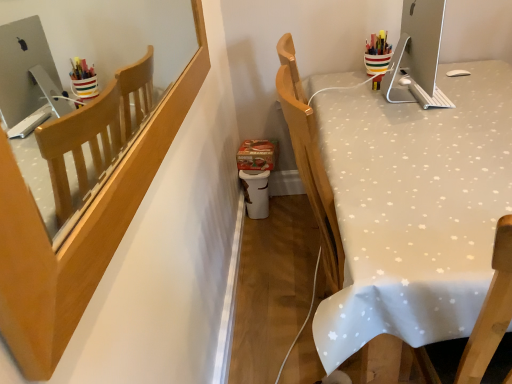
The image size is (512, 384). Describe the element at coordinates (415, 209) in the screenshot. I see `white fabric-covered desk at right` at that location.

What do you see at coordinates (418, 54) in the screenshot?
I see `satin silver monitor at upper right` at bounding box center [418, 54].

Find the location of a particular element. wooden chair back at upper left is located at coordinates (92, 99).

This screenshot has height=384, width=512. Identify the location of white fabric-covered desk at right. [x=415, y=209].

Consider the image. Is satin silver monitor at upper right surrounded by wooden chair back at upper left?

No, satin silver monitor at upper right is located outside of wooden chair back at upper left.

Locate an element on the screen. desktop behind the wooden chair back at upper left is located at coordinates (418, 54).

Based on the photo, from the image's perspective, between wooden chair back at upper left and satin silver monitor at upper right, who is located below?

wooden chair back at upper left is shown below in the image.

Considering the sizes of objects wooden chair back at upper left and satin silver monitor at upper right in the image provided, who is thinner, wooden chair back at upper left or satin silver monitor at upper right?

Thinner between the two is wooden chair back at upper left.

From the image's perspective, is satin silver monitor at upper right below wooden chair back at upper left?

Actually, satin silver monitor at upper right appears above wooden chair back at upper left in the image.

Is satin silver monitor at upper right inside or outside of wooden chair back at upper left?

The correct answer is: outside.

Between satin silver monitor at upper right and wooden chair back at upper left, which one has smaller size?

wooden chair back at upper left.

Considering the points (445, 102) and (195, 22), which point is in front, point (445, 102) or point (195, 22)?

The point (445, 102) is more forward.

Considering the relative sizes of white fabric-covered desk at right and wooden chair back at upper left in the image provided, is white fabric-covered desk at right bigger than wooden chair back at upper left?

Yes.

Can you confirm if white fabric-covered desk at right is wider than wooden chair back at upper left?

Indeed, white fabric-covered desk at right has a greater width compared to wooden chair back at upper left.

Does white fabric-covered desk at right appear on the left side of wooden chair back at upper left?

No.

Is white fabric-covered desk at right located outside wooden chair back at upper left?

Yes.

Can you tell me how much wooden chair back at upper left and white fabric-covered desk at right differ in facing direction?

wooden chair back at upper left and white fabric-covered desk at right are facing 90 degrees away from each other.

From the image's perspective, is wooden chair back at upper left on top of white fabric-covered desk at right?

Yes, from the image's perspective, wooden chair back at upper left is above white fabric-covered desk at right.

Locate an element on the screen. desk located underneath the wooden chair back at upper left (from a real-world perspective) is located at coordinates (415, 209).

Considering the sizes of objects wooden chair back at upper left and white fabric-covered desk at right in the image provided, who is bigger, wooden chair back at upper left or white fabric-covered desk at right?

With larger size is white fabric-covered desk at right.

How many degrees apart are the facing directions of satin silver monitor at upper right and white fabric-covered desk at right?

They differ by 90 degrees in their facing directions.

Does satin silver monitor at upper right come behind white fabric-covered desk at right?

Yes, it is.

Is satin silver monitor at upper right oriented away from white fabric-covered desk at right?

No, satin silver monitor at upper right's orientation is not away from white fabric-covered desk at right.

From the image's perspective, is satin silver monitor at upper right under white fabric-covered desk at right?

Actually, satin silver monitor at upper right appears above white fabric-covered desk at right in the image.

Based on their sizes in the image, would you say white fabric-covered desk at right is bigger or smaller than satin silver monitor at upper right?

In the image, white fabric-covered desk at right appears to be larger than satin silver monitor at upper right.

Considering the relative positions of white fabric-covered desk at right and satin silver monitor at upper right in the image provided, is white fabric-covered desk at right to the right of satin silver monitor at upper right from the viewer's perspective?

Indeed, white fabric-covered desk at right is positioned on the right side of satin silver monitor at upper right.

How different are the orientations of white fabric-covered desk at right and satin silver monitor at upper right in degrees?

They differ by 90 degrees in their facing directions.

Where is `desktop on the right side of wooden chair back at upper left`? The height and width of the screenshot is (384, 512). desktop on the right side of wooden chair back at upper left is located at coordinates (418, 54).

Locate an element on the screen. Image resolution: width=512 pixels, height=384 pixels. mirror in front of the satin silver monitor at upper right is located at coordinates (92, 99).

Considering their positions, is wooden chair back at upper left positioned further to white fabric-covered desk at right than satin silver monitor at upper right?

Based on the image, wooden chair back at upper left appears to be further to white fabric-covered desk at right.

Which object lies further to the anchor point wooden chair back at upper left, white fabric-covered desk at right or satin silver monitor at upper right?

satin silver monitor at upper right is positioned further to the anchor wooden chair back at upper left.

Estimate the real-world distances between objects in this image. Which object is closer to satin silver monitor at upper right, wooden chair back at upper left or white fabric-covered desk at right?

white fabric-covered desk at right is positioned closer to the anchor satin silver monitor at upper right.

Looking at this image, from the image, which object appears to be nearer to satin silver monitor at upper right, white fabric-covered desk at right or wooden chair back at upper left?

white fabric-covered desk at right.

From the image, which object appears to be farther from white fabric-covered desk at right, satin silver monitor at upper right or wooden chair back at upper left?

wooden chair back at upper left is further to white fabric-covered desk at right.

Estimate the real-world distances between objects in this image. Which object is further from wooden chair back at upper left, satin silver monitor at upper right or white fabric-covered desk at right?

Among the two, satin silver monitor at upper right is located further to wooden chair back at upper left.

Where is `desk positioned between wooden chair back at upper left and satin silver monitor at upper right from near to far`? desk positioned between wooden chair back at upper left and satin silver monitor at upper right from near to far is located at coordinates (415, 209).